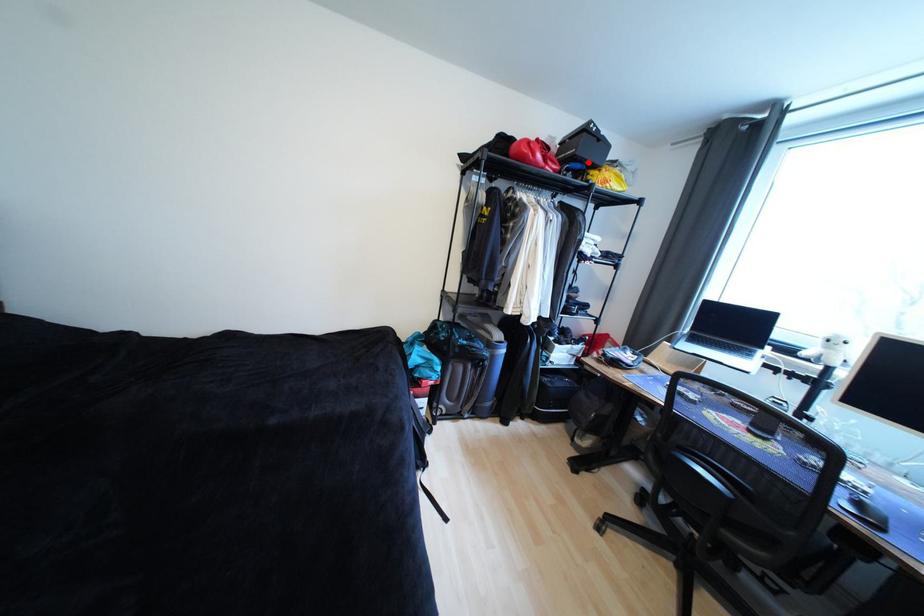
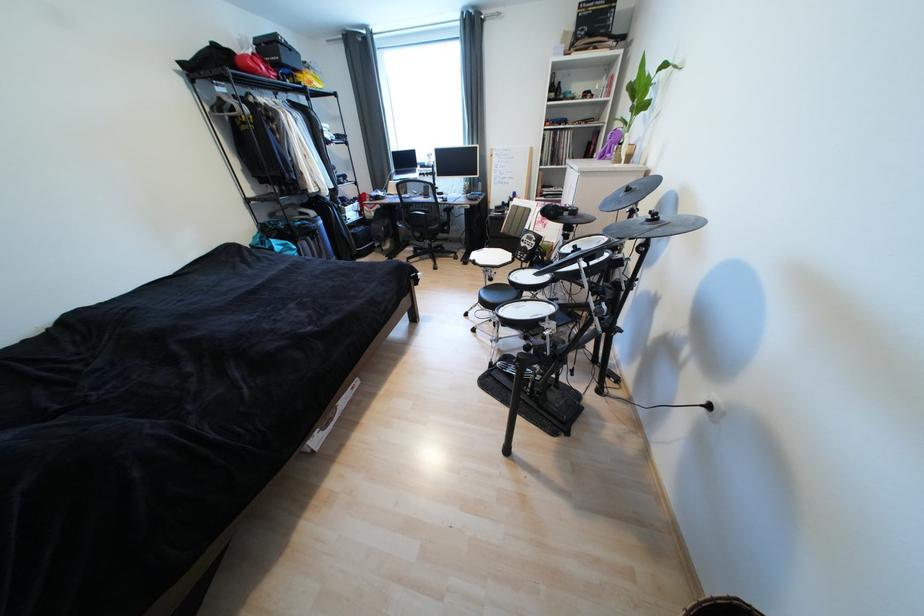
Find the pixel in the second image that matches the highlighted location in the first image.

(294, 68)